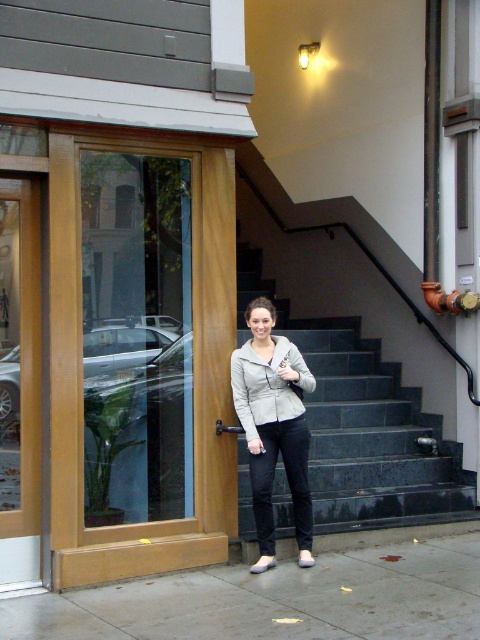
Is clear glass door at left to the left of dark gray stone stairs at center from the viewer's perspective?

Yes, clear glass door at left is to the left of dark gray stone stairs at center.

Does clear glass door at left have a smaller size compared to dark gray stone stairs at center?

Yes, clear glass door at left is smaller than dark gray stone stairs at center.

Between point (233, 257) and point (408, 506), which one is positioned in front?

Point (233, 257) is more forward.

The image size is (480, 640). In order to click on clear glass door at left in this screenshot , I will do `click(140, 355)`.

Does point (433, 548) come farther from viewer compared to point (289, 390)?

Yes, point (433, 548) is behind point (289, 390).

Does point (259, 605) come behind point (298, 376)?

No, it is in front of (298, 376).

Locate an element on the screen. gray concrete pavement at lower center is located at coordinates (276, 600).

Identify the location of clear glass door at left. This screenshot has width=480, height=640. (140, 355).

Between clear glass door at left and gray matte jacket at center, which one has more height?

With more height is clear glass door at left.

Find the location of a particular element. The image size is (480, 640). clear glass door at left is located at coordinates (140, 355).

The image size is (480, 640). In order to click on clear glass door at left in this screenshot , I will do `click(140, 355)`.